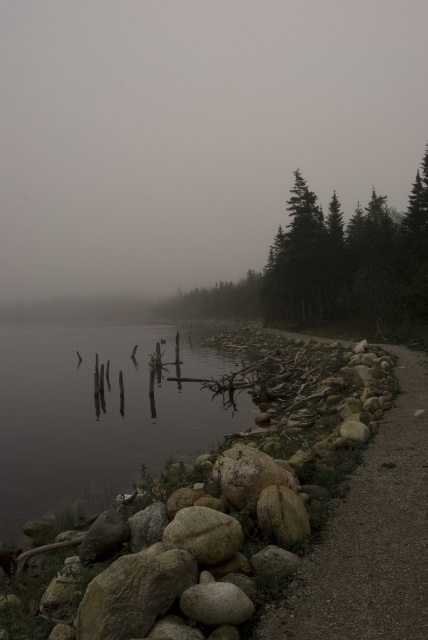
Is gravel path at lower right wider than smooth gray rock at lower center?

Yes, gravel path at lower right is wider than smooth gray rock at lower center.

Does gravel path at lower right appear over smooth gray rock at lower center?

Yes, gravel path at lower right is above smooth gray rock at lower center.

Describe the element at coordinates (371, 536) in the screenshot. This screenshot has width=428, height=640. I see `gravel path at lower right` at that location.

Identify the location of gravel path at lower right. The width and height of the screenshot is (428, 640). (371, 536).

Which is above, green matte trees at center or smooth beige rock at lower center?

green matte trees at center

At what (x,y) coordinates should I click in order to perform the action: click on green matte trees at center. Please return your answer as a coordinate pair (x, y). This screenshot has width=428, height=640. Looking at the image, I should click on (332, 268).

Identify the location of green matte trees at center. (332, 268).

Is green matte tree at center taller than smooth gray rock at lower center?

Yes.

Can you confirm if green matte tree at center is bigger than smooth gray rock at lower center?

Yes, green matte tree at center is bigger than smooth gray rock at lower center.

Who is more distant from viewer, (250,273) or (214,580)?

Point (250,273)

Find the location of a particular element. Image resolution: width=428 pixels, height=640 pixels. green matte tree at center is located at coordinates (216, 300).